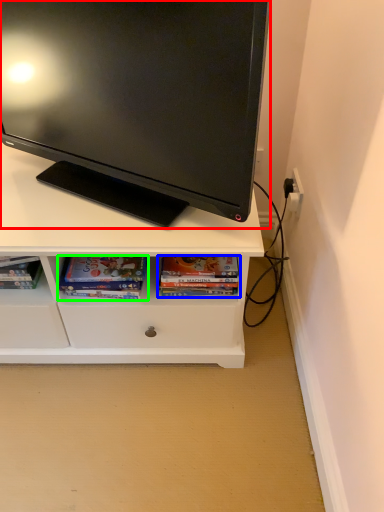
Question: Which is nearer to the television (highlighted by a red box)? book (highlighted by a blue box) or book (highlighted by a green box).

Choices:
 (A) book
 (B) book

Answer: (B)